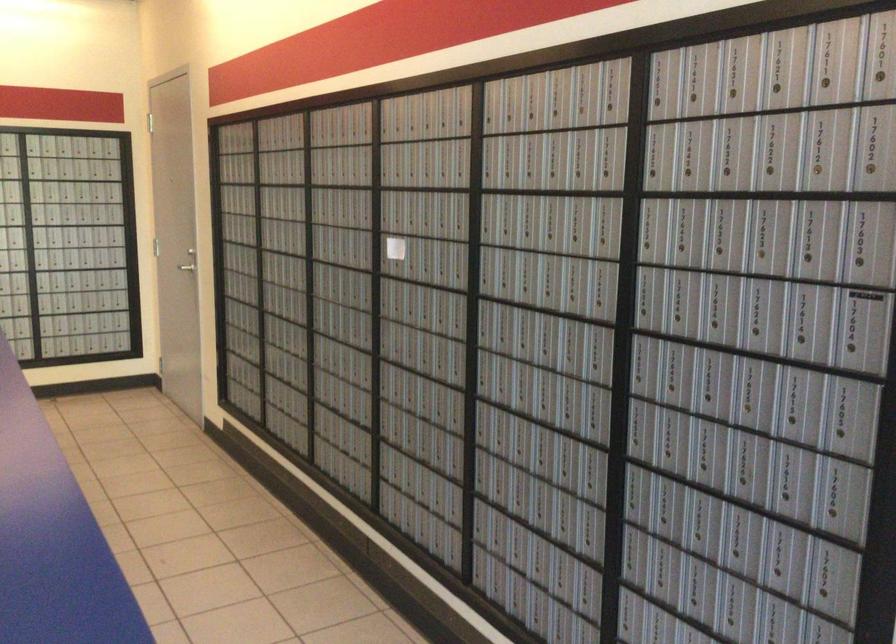
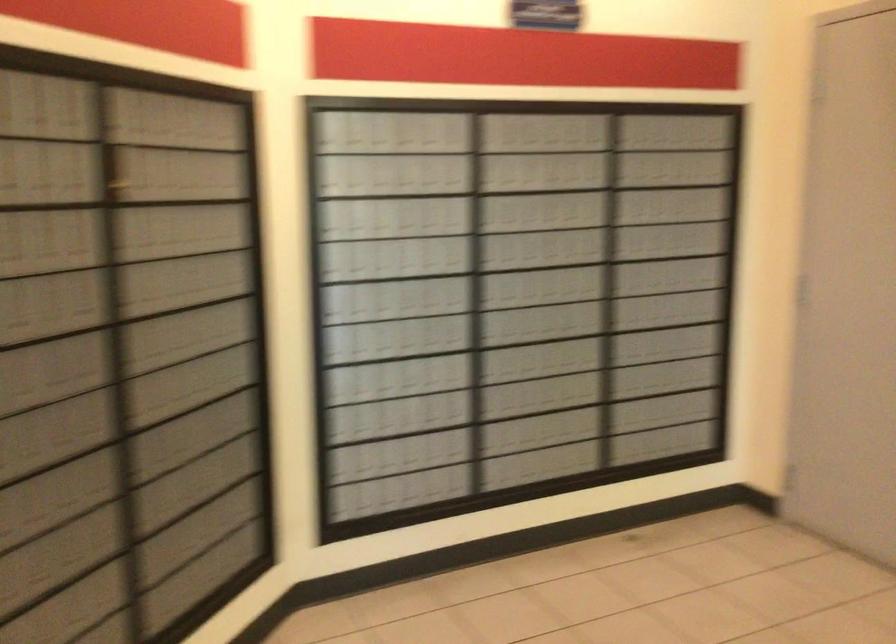
The images are taken continuously from a first-person perspective. In which direction are you moving?

The cameraman moved toward left, forward.